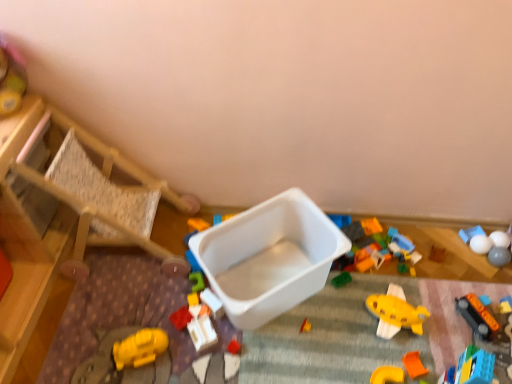
Find the location of a particular element. The width and height of the screenshot is (512, 384). empty space that is in between orange matte plastic toy at lower right, which is counted as the 5th toy, starting from the left, and white plastic container at center, which is counted as the 12th toy, starting from the right is located at coordinates (294, 357).